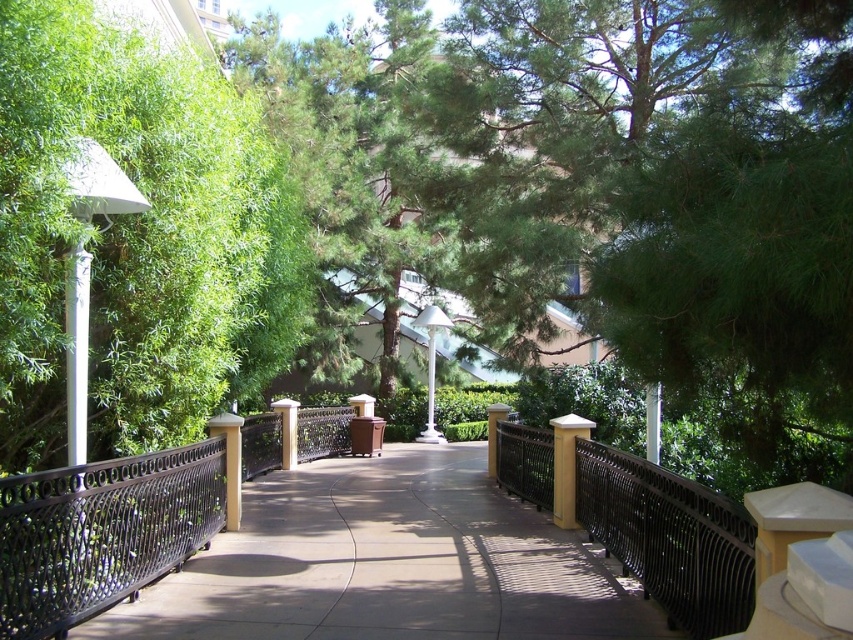
Question: Can you confirm if white glossy lamp post at center is bigger than yellow matte pillar at center?

Choices:
 (A) yes
 (B) no

Answer: (A)

Question: From the image, what is the correct spatial relationship of brown wrought iron fence at center in relation to black wrought iron fence at center?

Choices:
 (A) right
 (B) left

Answer: (B)

Question: Does white glossy pillar at center appear on the left side of yellow matte pillar at center?

Choices:
 (A) no
 (B) yes

Answer: (B)

Question: Among these objects, which one is nearest to the camera?

Choices:
 (A) white glossy lamp post at center
 (B) concrete pavement at center
 (C) matte white pillar at center
 (D) black wrought iron fence at center

Answer: (D)

Question: Which of the following is the farthest from the observer?

Choices:
 (A) (556, 436)
 (B) (430, 392)
 (C) (531, 609)

Answer: (B)

Question: Which point is closer to the camera?

Choices:
 (A) concrete pavement at center
 (B) wooden post at center
 (C) yellow matte pillar at center
 (D) white glossy lamp post at center

Answer: (A)